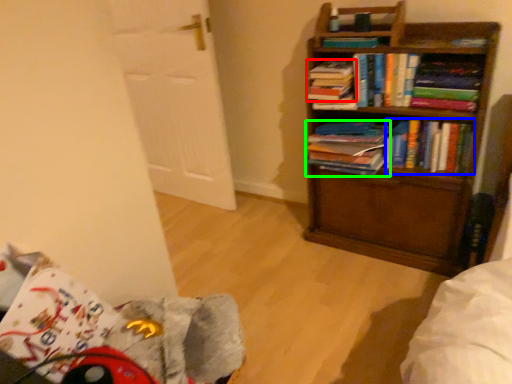
Question: Considering the real-world distances, which object is farthest from book (highlighted by a red box)? book (highlighted by a blue box) or book (highlighted by a green box)?

Choices:
 (A) book
 (B) book

Answer: (A)